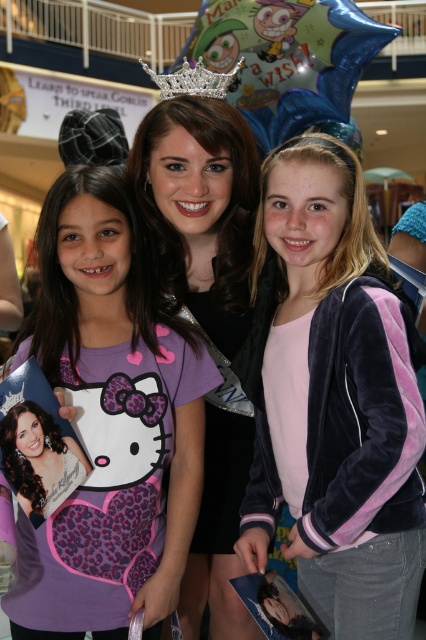
You are a photographer trying to capture a closeup shot of the silver glittery tiara at upper center without the matte black dress at center blocking the view. Is the tiara positioned in a way that allows this?

The silver glittery tiara at upper center is at upper center and the matte black dress at center is at center. Since the tiara is above the dress, it should be possible to angle the camera upwards to capture the tiara without the dress blocking the view.

Looking at the scene in the shopping mall, there is a purple matte shirt at center and a silver glittery tiara at upper center. Which object is positioned to the left of the other?

The purple matte shirt at center is to the left of silver glittery tiara at upper center.

What is the exact coordinate of the matte black dress at center?

The matte black dress at center is located at point (x=207, y=316).